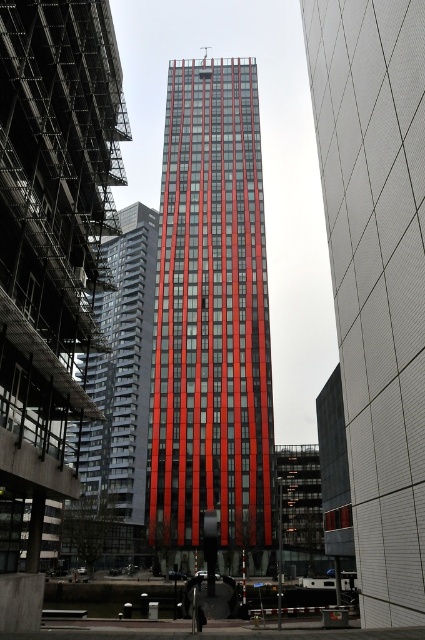
You are an architect reviewing a cityscape design. You notice two central structures labeled as the red glass building at center and the red glass tower at center. Based on the provided scene description, which of these two structures is the taller one?

The red glass tower at center is taller than the red glass building at center.

You are standing in front of the urban landscape scene. You want to take a photo of the red glass building at center. Considering the distance between you and the building, will you need to use a zoom lens to capture the entire structure in your shot?

The red glass building at center is 8.74 meters away from the viewer. Whether a zoom lens is needed depends on the focal length of your camera. If your camera has a wide enough angle to capture the entire building at this distance without cropping, a zoom lens might not be necessary. However, if the building occupies a large portion of the frame or you want to emphasize its height, using a zoom lens could help ensure the entire structure fits in the photo.